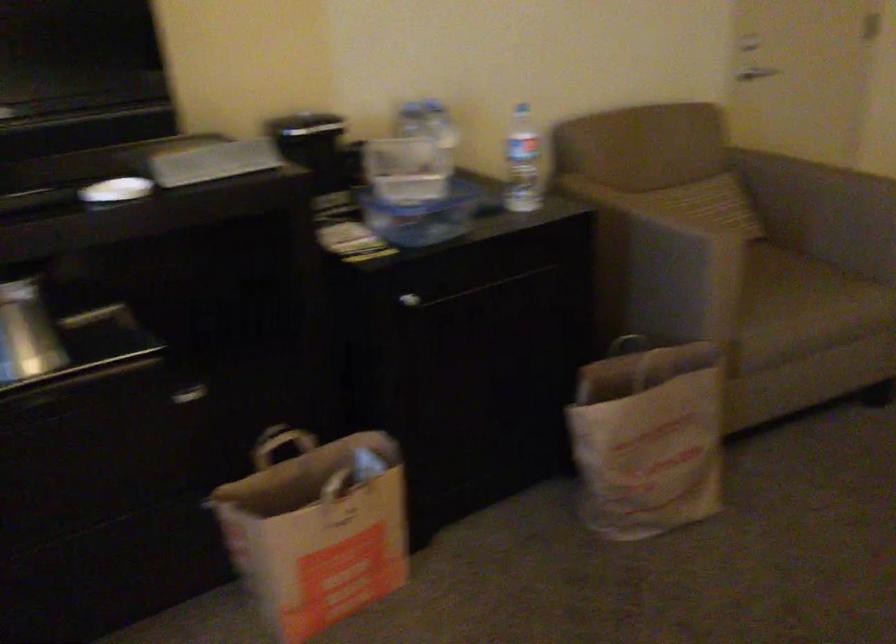
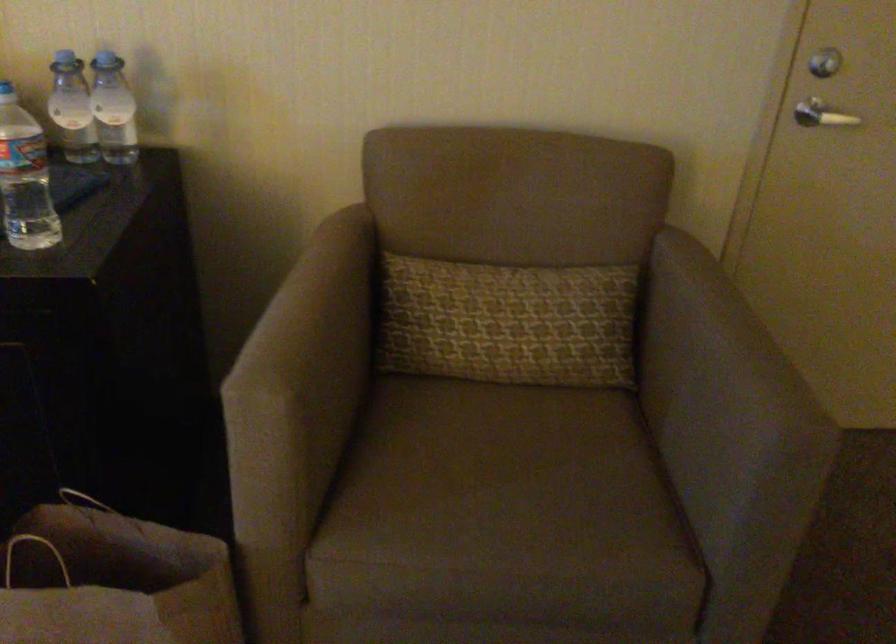
What movement of the cameraman would produce the second image?

The movement direction of the cameraman is right, forward.